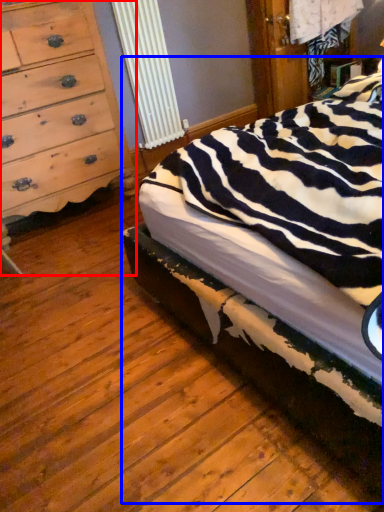
Question: Which object appears closest to the camera in this image, chest of drawers (highlighted by a red box) or bed (highlighted by a blue box)?

Choices:
 (A) chest of drawers
 (B) bed

Answer: (B)